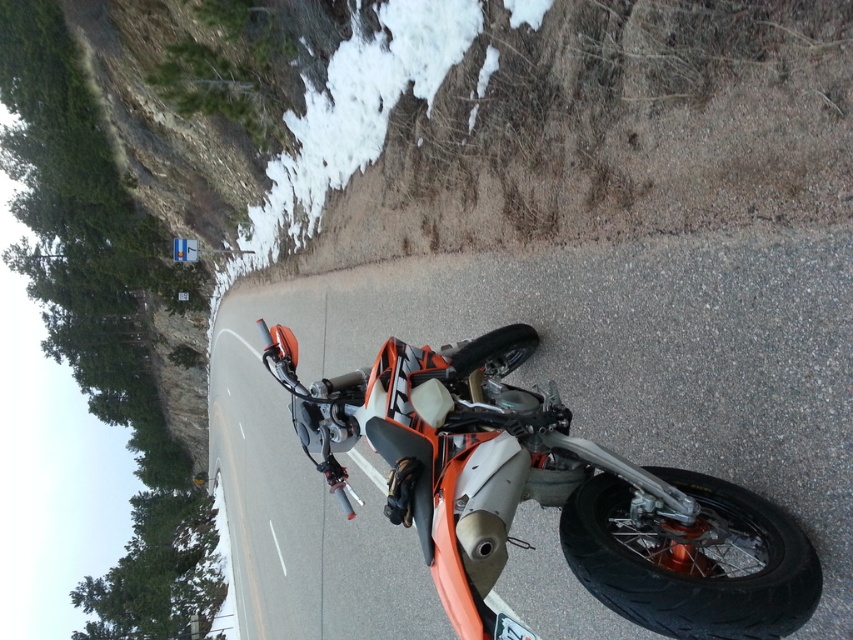
You are a hiker who wants to take a shortcut through the snow. You see the white powdery snow at upper center and the black rubber tire at lower center. Which object is closer to you as you approach the scene?

The white powdery snow at upper center is closer to you because the black rubber tire at lower center is behind it.